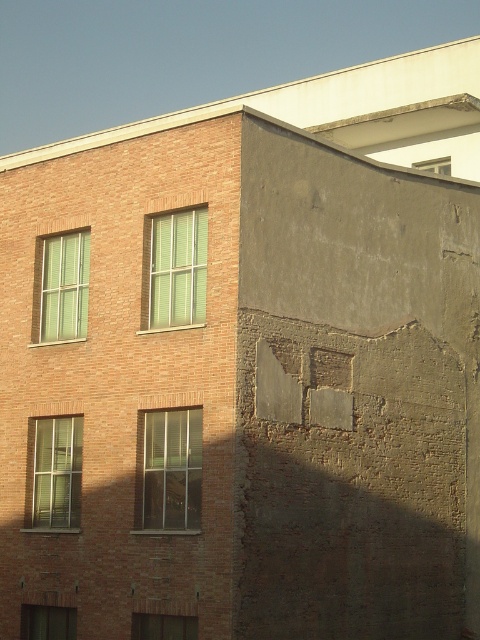
Looking at this image, is clear glass window at center below green matte window at center?

Yes.

From the picture: Can you confirm if clear glass window at center is smaller than green matte window at center?

Yes, clear glass window at center is smaller than green matte window at center.

Who is more forward, (196, 509) or (194, 216)?

Point (196, 509) is in front.

The image size is (480, 640). I want to click on clear glass window at center, so click(171, 468).

In the scene shown: Is green matte window at center positioned before green matte window at upper left?

Yes.

Consider the image. Does green matte window at center have a greater height compared to green matte window at upper left?

No.

Which is behind, point (170, 308) or point (45, 243)?

The point (45, 243) is behind.

Identify the location of green matte window at center. The width and height of the screenshot is (480, 640). (178, 268).

Which is above, clear glass window at center or matte glass window at lower left?

clear glass window at center is above.

Can you confirm if clear glass window at center is positioned below matte glass window at lower left?

No, clear glass window at center is not below matte glass window at lower left.

What do you see at coordinates (171, 468) in the screenshot?
I see `clear glass window at center` at bounding box center [171, 468].

The height and width of the screenshot is (640, 480). In order to click on clear glass window at center in this screenshot , I will do [x=171, y=468].